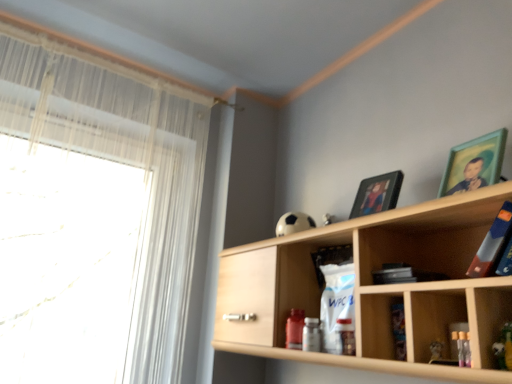
Question: Should I look upward or downward to see hardcover book at upper right?

Choices:
 (A) up
 (B) down

Answer: (B)

Question: Considering the relative sizes of wooden shelf at upper right and hardcover book at upper right in the image provided, is wooden shelf at upper right thinner than hardcover book at upper right?

Choices:
 (A) no
 (B) yes

Answer: (A)

Question: Is the depth of wooden shelf at upper right less than that of hardcover book at upper right?

Choices:
 (A) no
 (B) yes

Answer: (B)

Question: Is wooden shelf at upper right positioned far away from hardcover book at upper right?

Choices:
 (A) no
 (B) yes

Answer: (A)

Question: Does wooden shelf at upper right lie behind hardcover book at upper right?

Choices:
 (A) no
 (B) yes

Answer: (A)

Question: Can you confirm if wooden shelf at upper right is wider than hardcover book at upper right?

Choices:
 (A) no
 (B) yes

Answer: (B)

Question: From the image's perspective, is wooden shelf at upper right beneath hardcover book at upper right?

Choices:
 (A) no
 (B) yes

Answer: (B)

Question: Is white sheer curtain at left shorter than matte black picture frame at upper center, the first picture frame from the back?

Choices:
 (A) yes
 (B) no

Answer: (B)

Question: Does white sheer curtain at left come behind matte black picture frame at upper center, the first picture frame from the back?

Choices:
 (A) no
 (B) yes

Answer: (B)

Question: Is white sheer curtain at left oriented away from matte black picture frame at upper center, the 1th picture frame from the left?

Choices:
 (A) yes
 (B) no

Answer: (B)

Question: Can you confirm if white sheer curtain at left is taller than matte black picture frame at upper center, the 1th picture frame from the left?

Choices:
 (A) no
 (B) yes

Answer: (B)

Question: From a real-world perspective, is white sheer curtain at left positioned under matte black picture frame at upper center, which is the second picture frame in front-to-back order, based on gravity?

Choices:
 (A) yes
 (B) no

Answer: (A)

Question: Can you confirm if white sheer curtain at left is smaller than matte black picture frame at upper center, the second picture frame positioned from the right?

Choices:
 (A) yes
 (B) no

Answer: (B)

Question: Can you confirm if green matte picture frame at upper right, arranged as the first picture frame when viewed from the right, is taller than white sheer curtain at left?

Choices:
 (A) yes
 (B) no

Answer: (B)